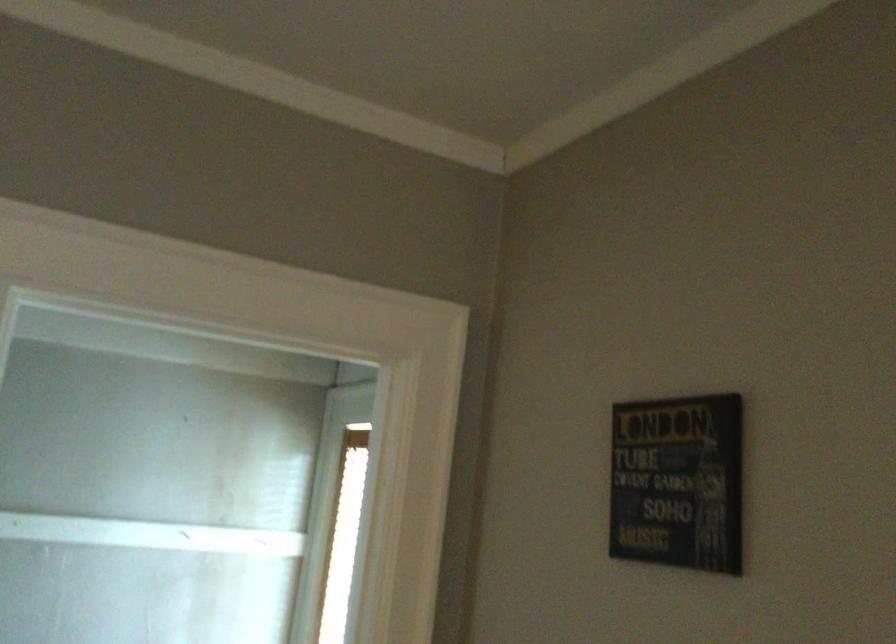
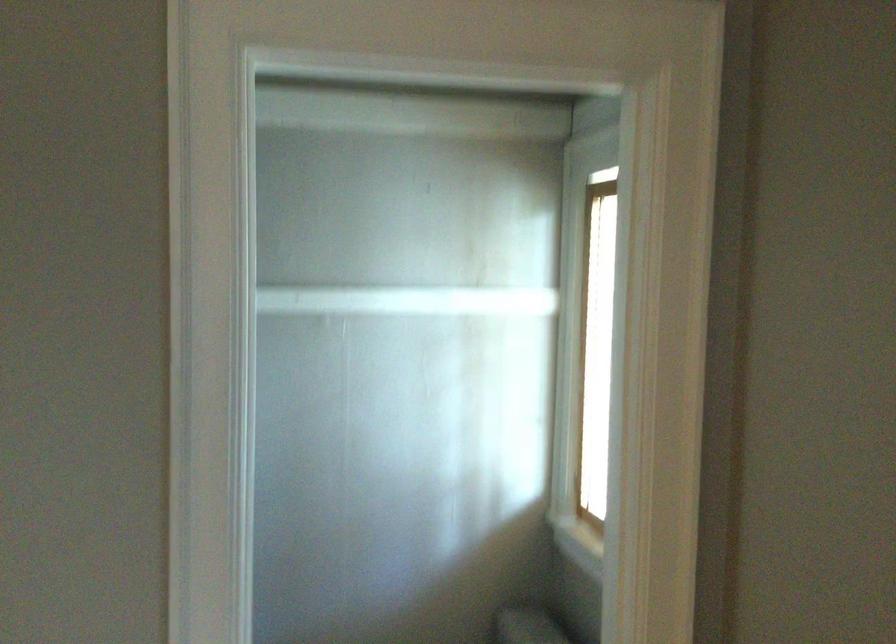
Find the pixel in the second image that matches point 144,536 in the first image.

(407, 301)